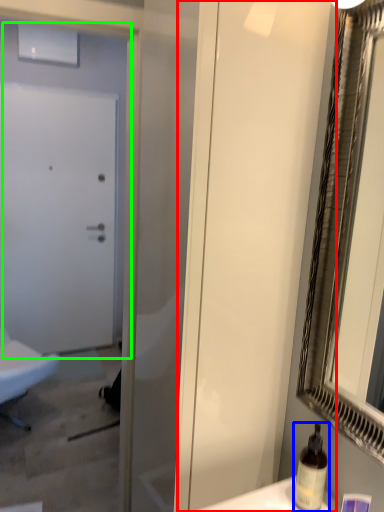
Question: Estimate the real-world distances between objects in this image. Which object is closer to screen door (highlighted by a red box), bottle (highlighted by a blue box) or door (highlighted by a green box)?

Choices:
 (A) bottle
 (B) door

Answer: (A)